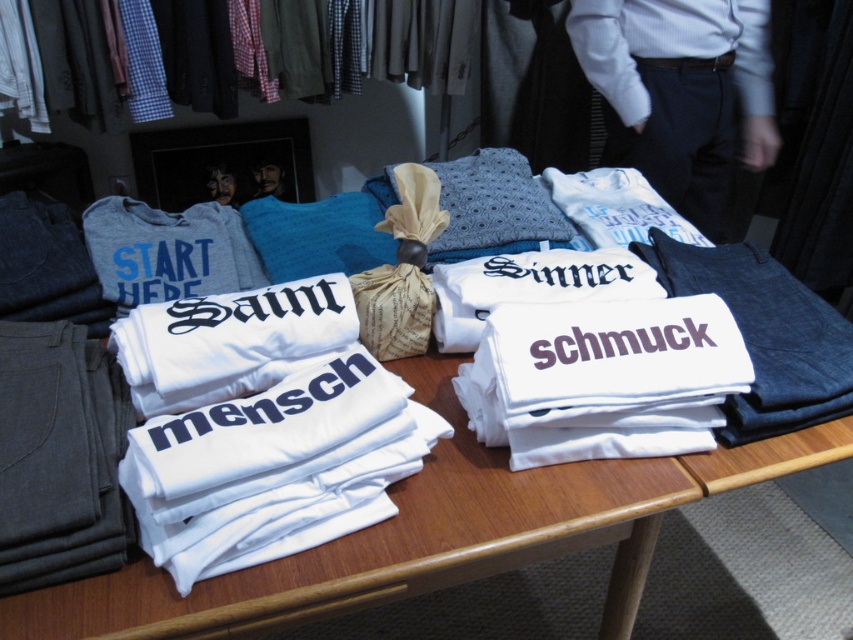
Consider the image. Who is more distant from viewer, (621, 36) or (229, 198)?

Positioned behind is point (229, 198).

In the scene shown: Is white shirt at upper right further to the viewer compared to smooth skin face at upper center?

No, it is in front of smooth skin face at upper center.

The height and width of the screenshot is (640, 853). I want to click on white shirt at upper right, so click(682, 93).

Is white shirt at upper right positioned behind smooth skin face at center?

No.

This screenshot has height=640, width=853. I want to click on white shirt at upper right, so click(x=682, y=93).

Where is `white shirt at upper right`? The image size is (853, 640). white shirt at upper right is located at coordinates (682, 93).

This screenshot has width=853, height=640. I want to click on white shirt at upper right, so click(x=682, y=93).

Who is more distant from viewer, (723, 179) or (387, 252)?

Point (723, 179)

Does white shirt at upper right appear under burlap pillow at center?

Actually, white shirt at upper right is above burlap pillow at center.

Image resolution: width=853 pixels, height=640 pixels. In order to click on white shirt at upper right in this screenshot , I will do `click(682, 93)`.